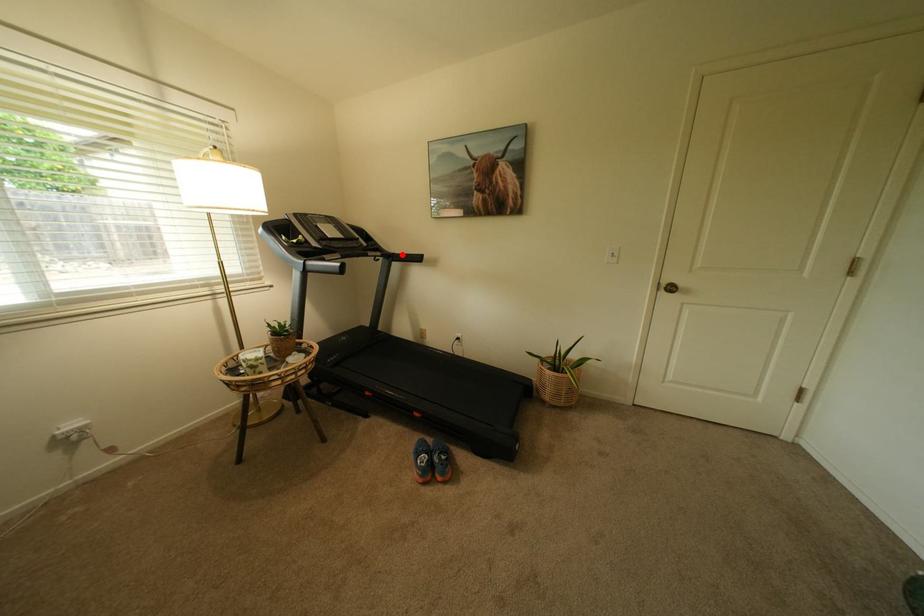
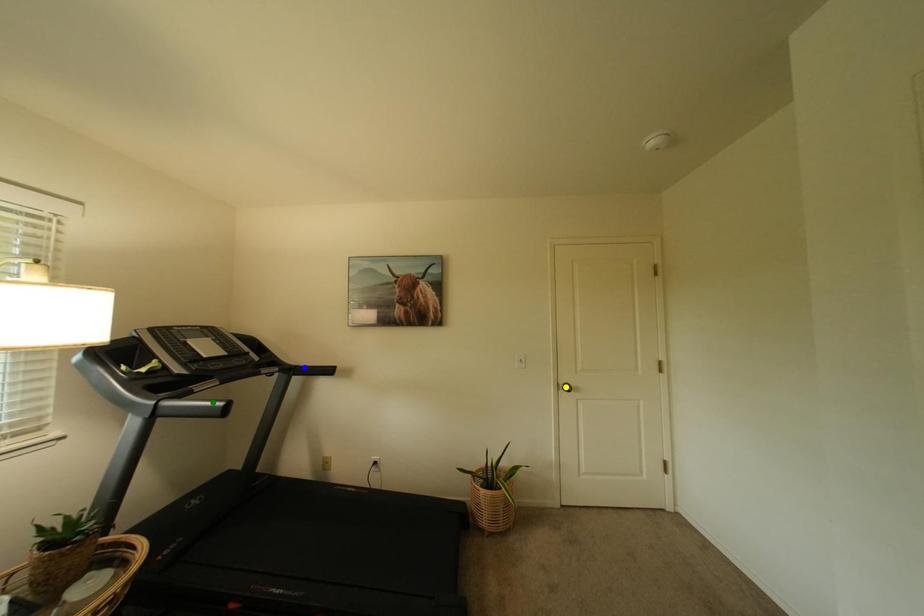
Question: I am providing you with two images of the same scene from different viewpoints. A red point is marked on the first image. You are given multiple points on the second image. Can you choose the point in image 2 that corresponds to the point in image 1?

Choices:
 (A) blue point
 (B) yellow point
 (C) green point

Answer: (A)